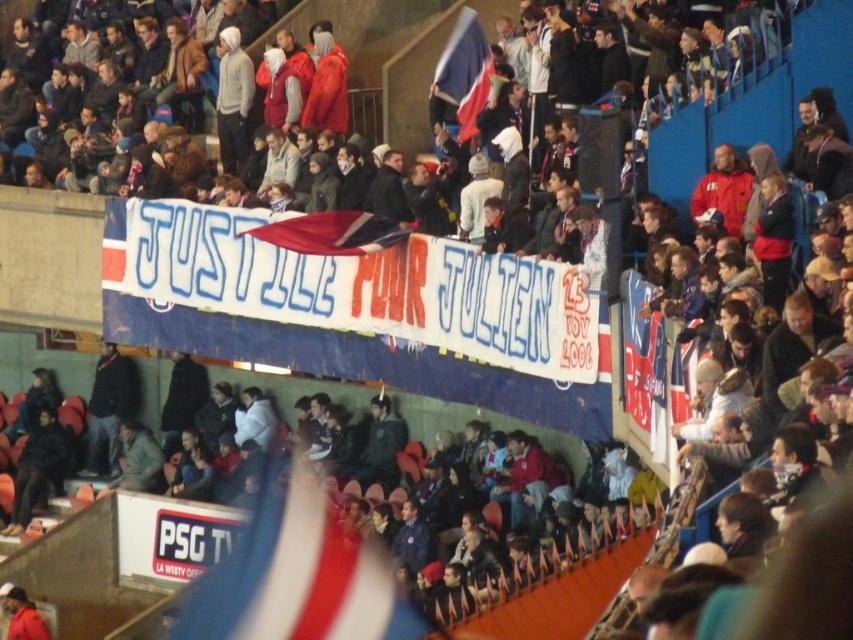
You are a photographer standing at the front row of the stadium. You want to take a photo of the dark blue jacket at center. Where should you point your camera to capture it?

The dark blue jacket at center is located at the 2D coordinates point (567, 596), so you should point your camera towards that coordinate to capture it.